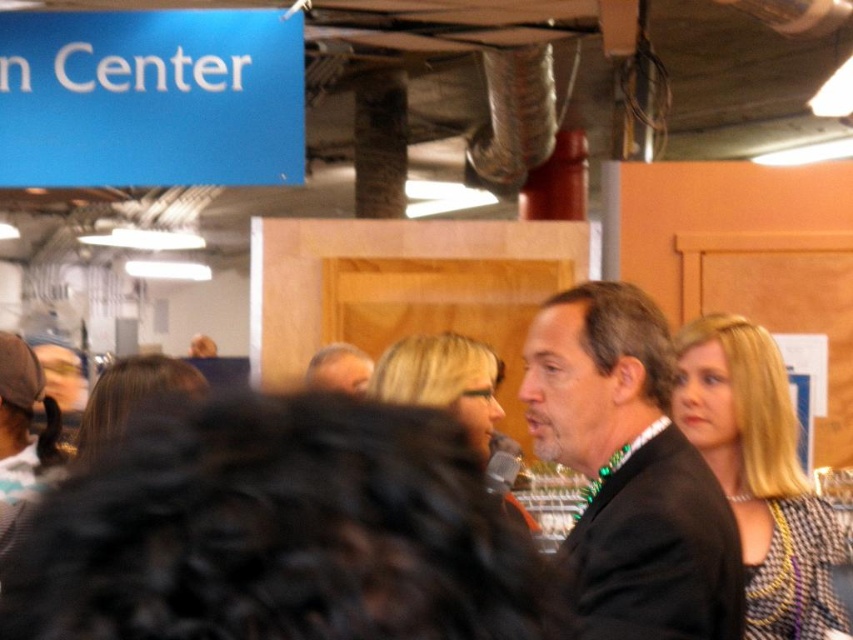
You are organizing a photo shoot and need to place two subjects in the frame. The subjects are the black suit at center and the light brown hair at center. Based on the scene description, which subject should you position closer to the camera to ensure both fit within the frame?

You should position the light brown hair at center closer to the camera since the black suit at center is wider. This adjustment will help balance their widths and ensure both fit within the frame.

You are standing at the entrance of the event venue and want to locate the speaker wearing the black suit at center. According to the image, where would you find him in terms of coordinates?

The speaker wearing the black suit at center is located at coordinates point (630, 472).

You are organizing a small event and need to place a 1.2 meter wide banner between the black suit at center and the wooden bulletin board at right. Given their sizes, will there be enough space?

The black suit at center is smaller than the wooden bulletin board at right, but the description does not provide specific measurements between them. Therefore, it is uncertain if the 1.2 meter wide banner will fit between them.